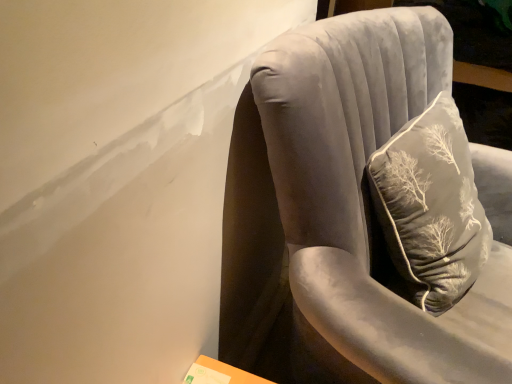
Describe the element at coordinates (365, 203) in the screenshot. I see `velvet gray chair at upper right` at that location.

This screenshot has height=384, width=512. Find the location of `velvet gray chair at upper right`. velvet gray chair at upper right is located at coordinates (365, 203).

At what (x,y) coordinates should I click in order to perform the action: click on velvet gray chair at upper right. Please return your answer as a coordinate pair (x, y). The width and height of the screenshot is (512, 384). Looking at the image, I should click on (365, 203).